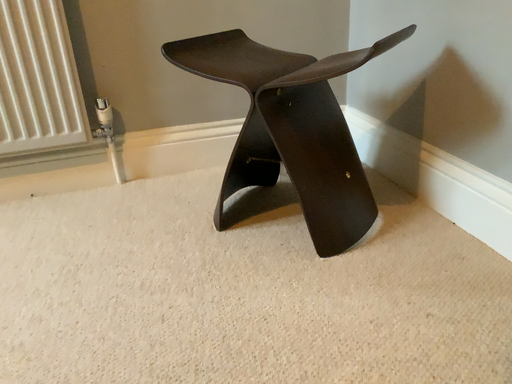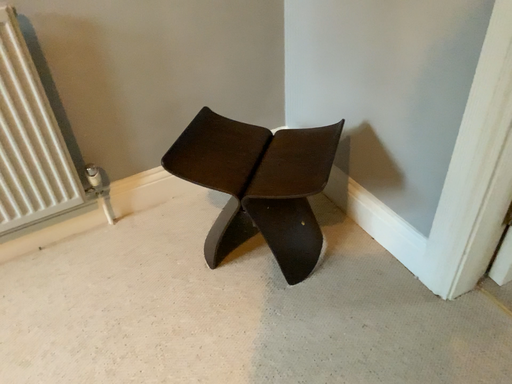
Question: How did the camera likely rotate when shooting the video?

Choices:
 (A) rotated upward
 (B) rotated downward

Answer: (B)